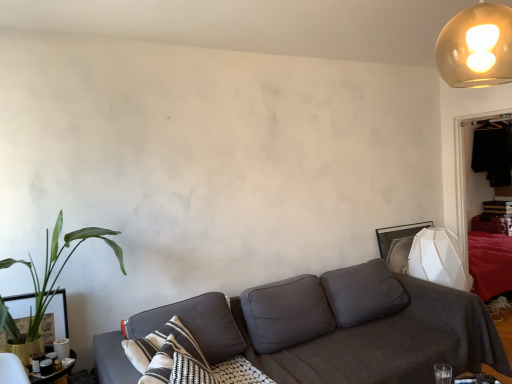
You are a GUI agent. You are given a task and a screenshot of the screen. Output one action in this format:
    pyautogui.click(x=<x>, y=<y>)
    Task: Click on the free spot above dark brown wooden dresser at right (from a real-world perspective)
    Image resolution: width=512 pixels, height=384 pixels.
    Given the screenshot: What is the action you would take?
    pyautogui.click(x=484, y=115)